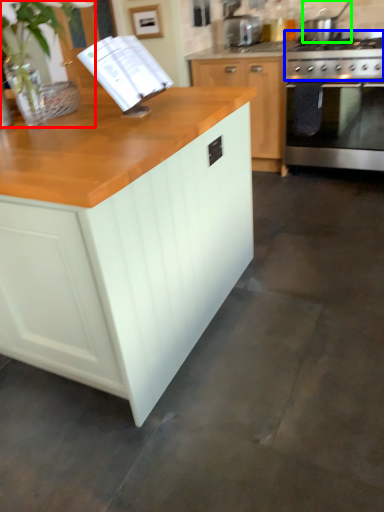
Question: Estimate the real-world distances between objects in this image. Which object is farther from plant (highlighted by a red box), gas stove (highlighted by a blue box) or kitchen appliance (highlighted by a green box)?

Choices:
 (A) gas stove
 (B) kitchen appliance

Answer: (B)